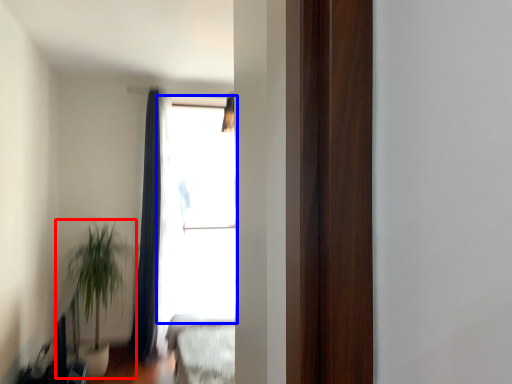
Question: Which point is closer to the camera, houseplant (highlighted by a red box) or window (highlighted by a blue box)?

Choices:
 (A) houseplant
 (B) window

Answer: (A)